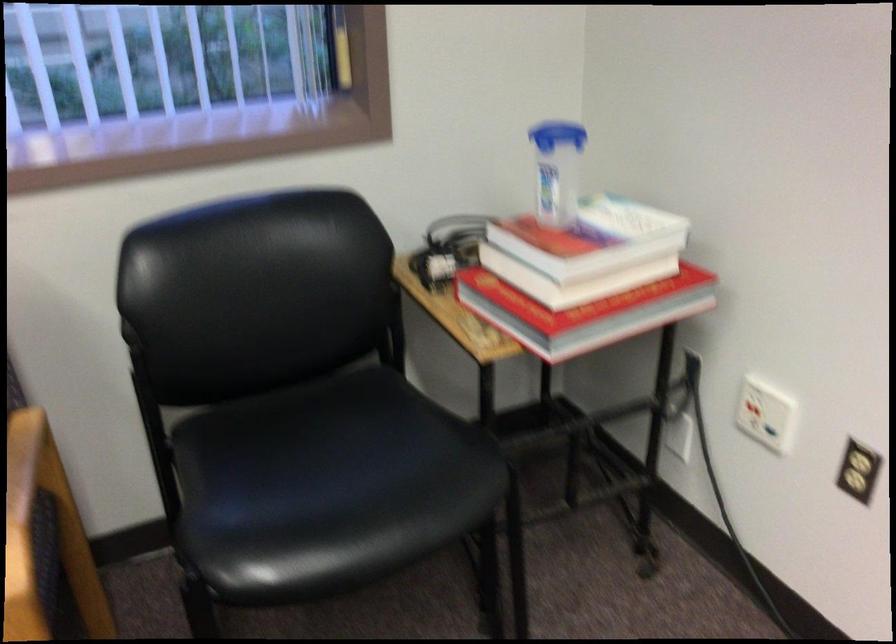
Where would you plugging in the brown wall outlet? Please return your answer as a coordinate pair (x, y).

(767, 413)